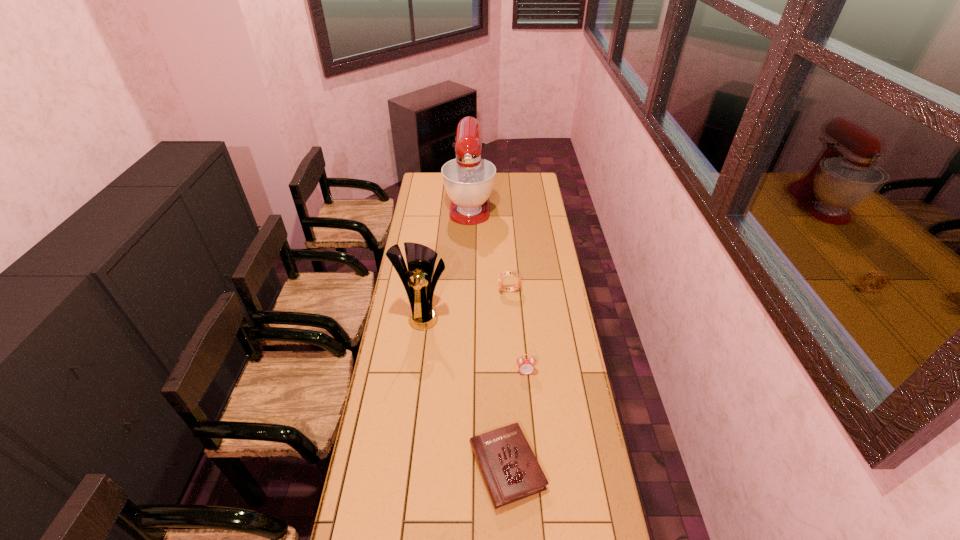
The height and width of the screenshot is (540, 960). Find the location of `mixer`. mixer is located at coordinates (468, 180).

Where is `the farthest object`? Image resolution: width=960 pixels, height=540 pixels. the farthest object is located at coordinates (468, 180).

Find the location of a particular element. The image size is (960, 540). the third nearest object is located at coordinates (421, 259).

At what (x,y) coordinates should I click in order to perform the action: click on the second tallest object. Please return your answer as a coordinate pair (x, y). Looking at the image, I should click on (421, 259).

What are the coordinates of `watch` in the screenshot? It's located at (507, 273).

Find the location of a particular element. the fourth farthest object is located at coordinates (526, 366).

The height and width of the screenshot is (540, 960). Identify the location of the nearest object. (511, 472).

Locate an element on the screen. This screenshot has width=960, height=540. hardback book is located at coordinates (511, 472).

The height and width of the screenshot is (540, 960). Identify the location of vacant region located 0.270m at the attachment hub of the farthest object. (468, 259).

Where is `vacant space situated at the front of the second tallest object, where the globe is visible`? This screenshot has height=540, width=960. vacant space situated at the front of the second tallest object, where the globe is visible is located at coordinates (416, 376).